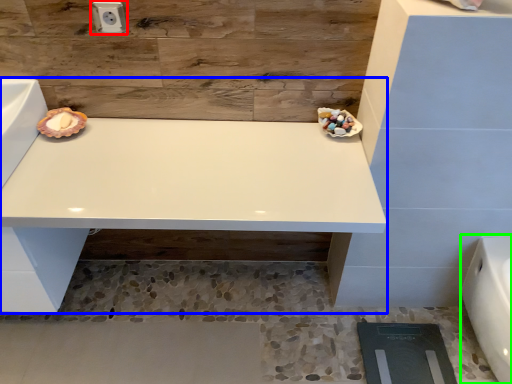
Question: Which object is the closest to the electric outlet (highlighted by a red box)? Choose among these: vanity (highlighted by a blue box) or porcelain (highlighted by a green box).

Choices:
 (A) vanity
 (B) porcelain

Answer: (A)